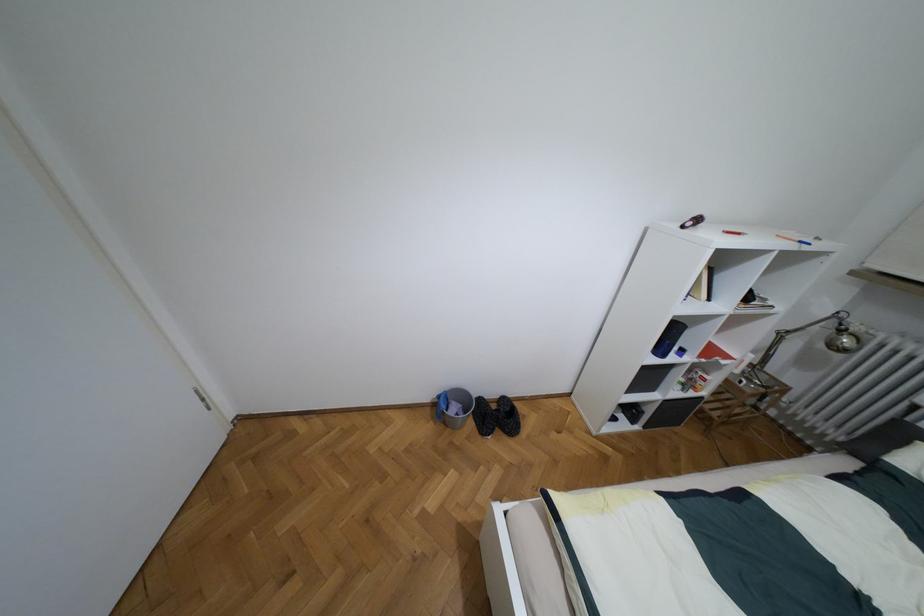
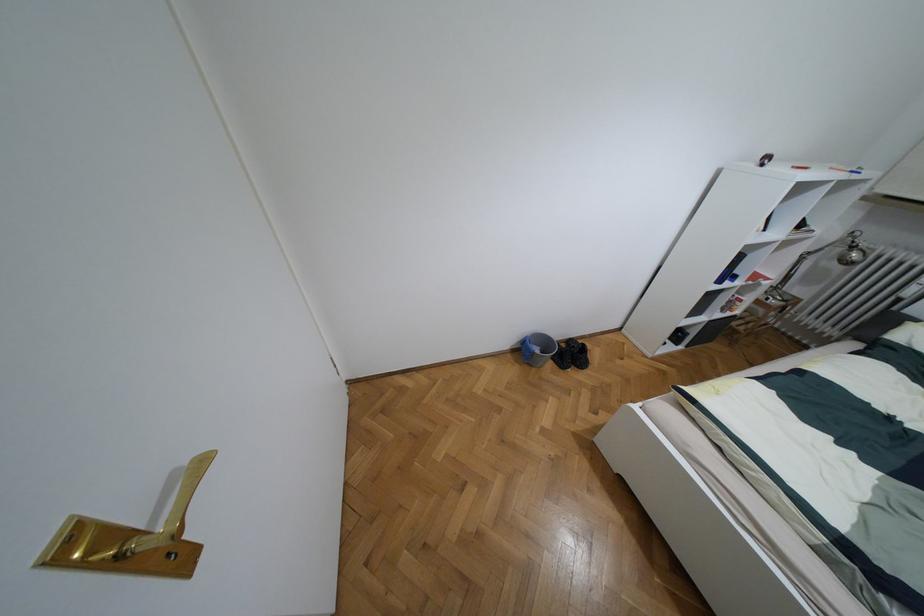
Find the pixel in the second image that matches [492,406] in the first image.

(563, 345)